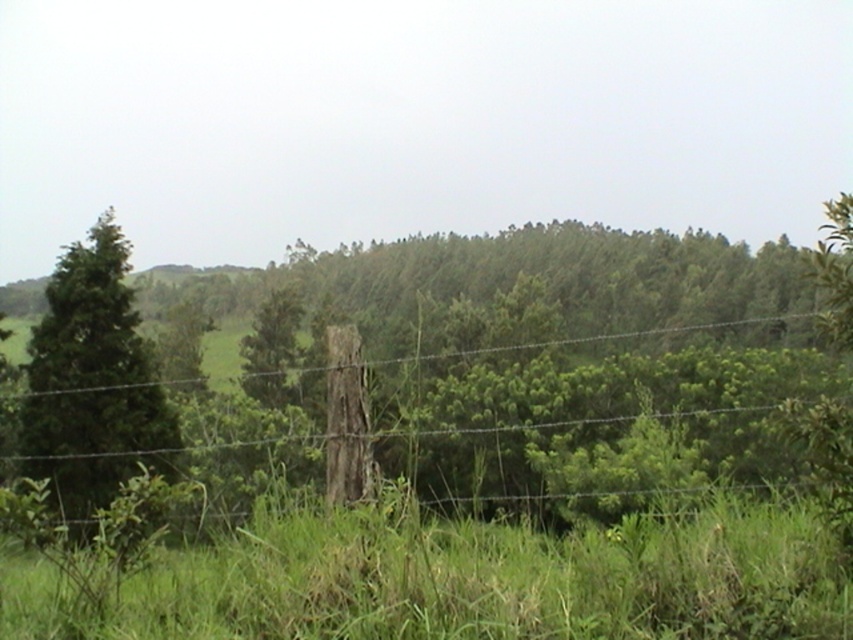
Between green matte tree at left and green matte tree at center, which one appears on the right side from the viewer's perspective?

green matte tree at left

Who is more forward, (70, 481) or (253, 355)?

Point (70, 481) is in front.

This screenshot has width=853, height=640. I want to click on green matte tree at left, so click(x=91, y=380).

Is point (756, 436) more distant than point (296, 326)?

No, it is not.

Can you confirm if wire mesh at center is thinner than green matte tree at center?

No, wire mesh at center is not thinner than green matte tree at center.

Which is in front, point (453, 458) or point (257, 387)?

Point (453, 458) is more forward.

Find the location of `wire mesh at center`. wire mesh at center is located at coordinates (611, 408).

Who is higher up, wire mesh at center or green matte tree at left?

Positioned higher is green matte tree at left.

Can you confirm if wire mesh at center is shorter than green matte tree at left?

No, wire mesh at center is not shorter than green matte tree at left.

Identify the location of wire mesh at center. (611, 408).